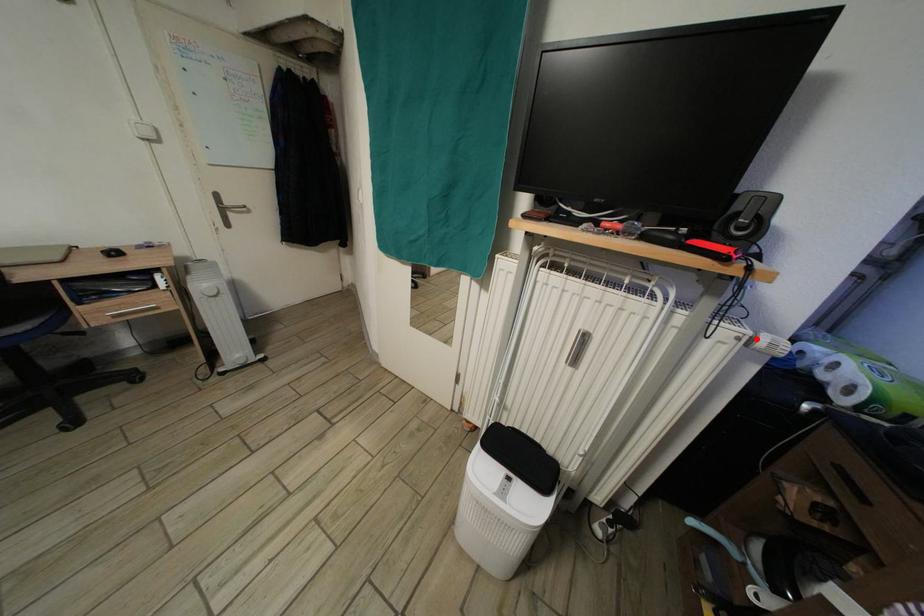
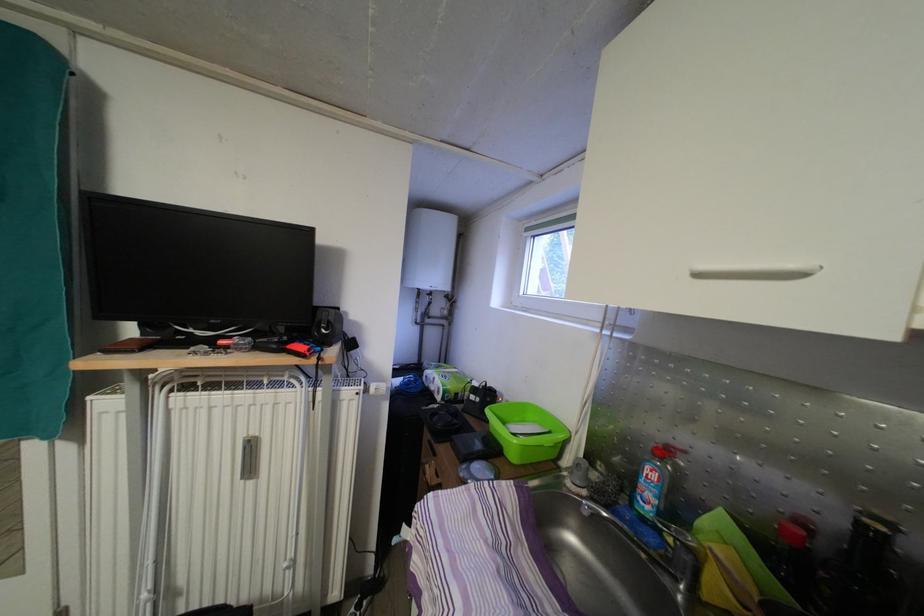
In the second image, find the point that corresponds to the highlighted location in the first image.

(369, 394)